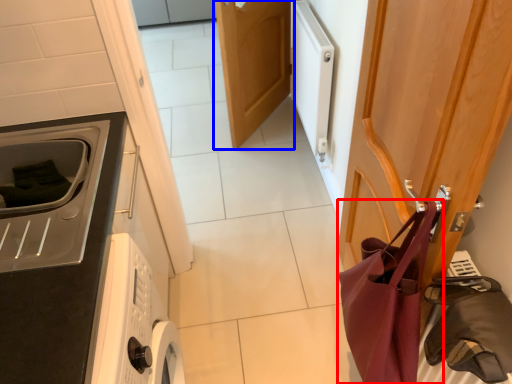
Question: Which of the following is the closest to the observer, shoulder bag (highlighted by a red box) or door (highlighted by a blue box)?

Choices:
 (A) shoulder bag
 (B) door

Answer: (A)